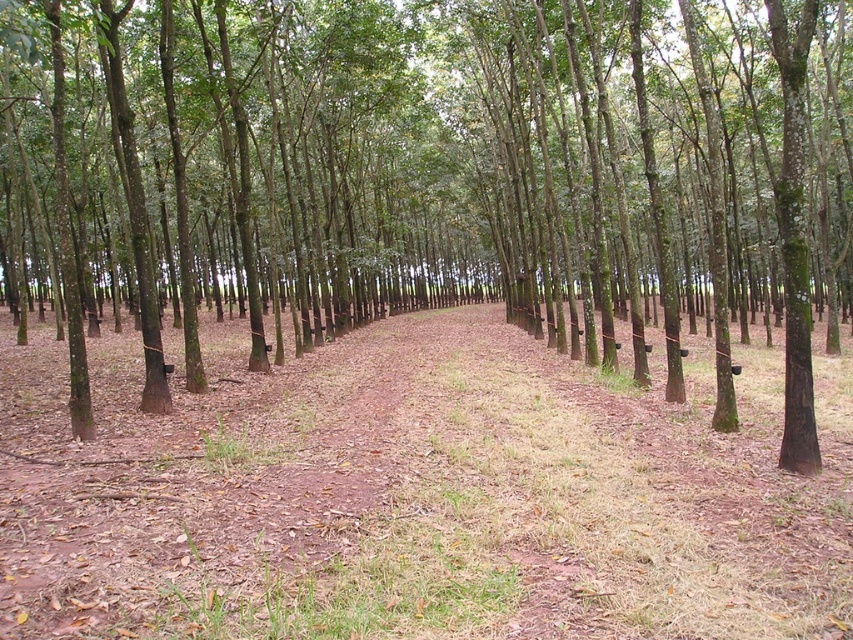
Question: Can you confirm if brown smooth tree at center is smaller than brown dirt trail at center?

Choices:
 (A) no
 (B) yes

Answer: (A)

Question: Can you confirm if brown smooth tree at center is bigger than brown dirt trail at center?

Choices:
 (A) no
 (B) yes

Answer: (B)

Question: Which of the following is the closest to the observer?

Choices:
 (A) brown smooth tree at center
 (B) brown dirt trail at center

Answer: (B)

Question: Can you confirm if brown smooth tree at center is bigger than brown dirt trail at center?

Choices:
 (A) no
 (B) yes

Answer: (B)

Question: Which of the following is the farthest from the observer?

Choices:
 (A) brown dirt trail at center
 (B) brown smooth tree at center

Answer: (B)